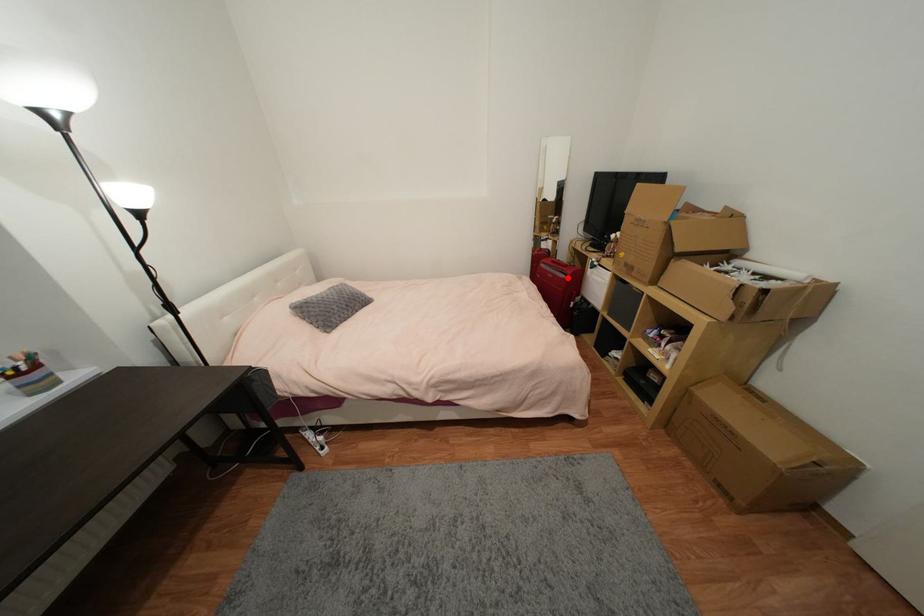
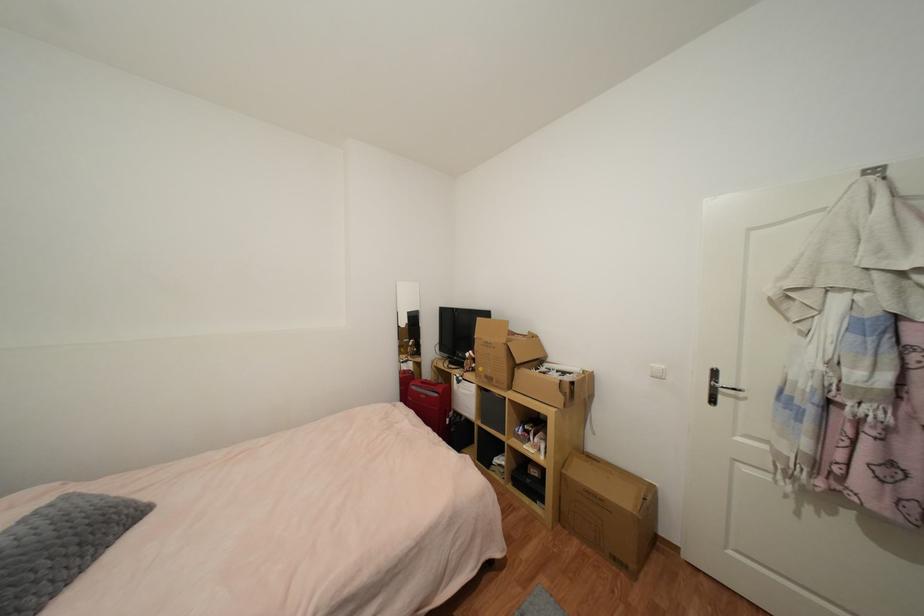
Find the pixel in the second image that matches the highlighted location in the first image.

(440, 397)